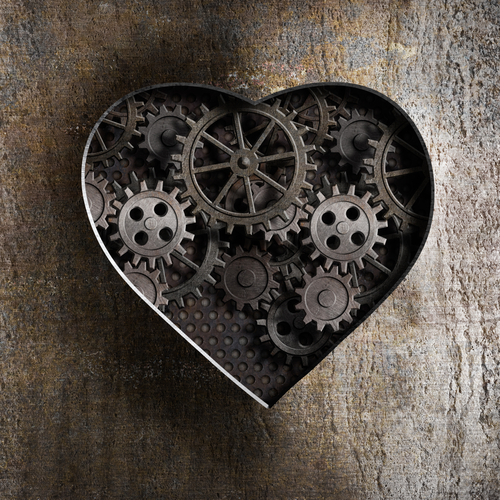
This screenshot has width=500, height=500. What are the coordinates of `heart shaped container` in the screenshot? It's located at (241, 389).